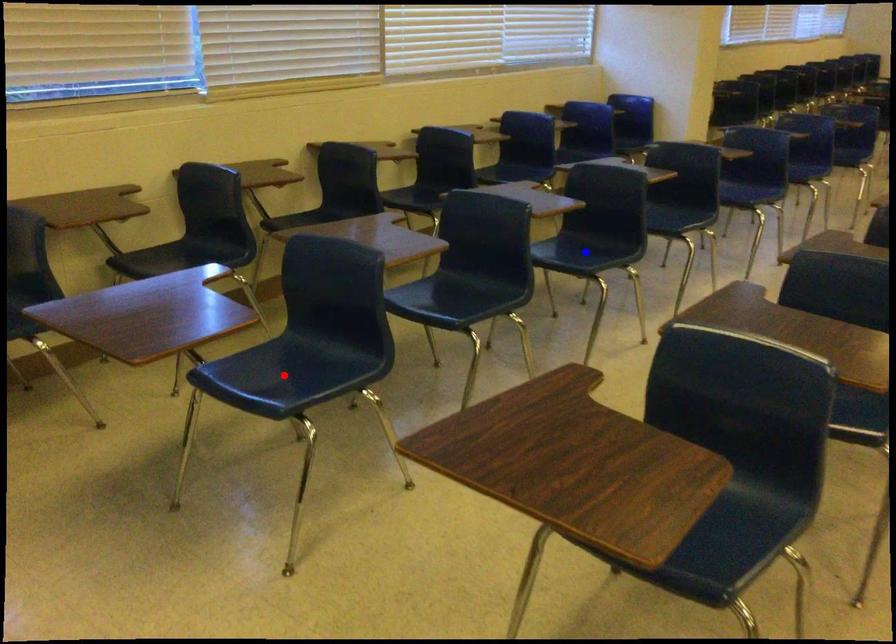
Question: Which of the two points in the image is closer to the camera?

Choices:
 (A) Blue point is closer.
 (B) Red point is closer.

Answer: (B)